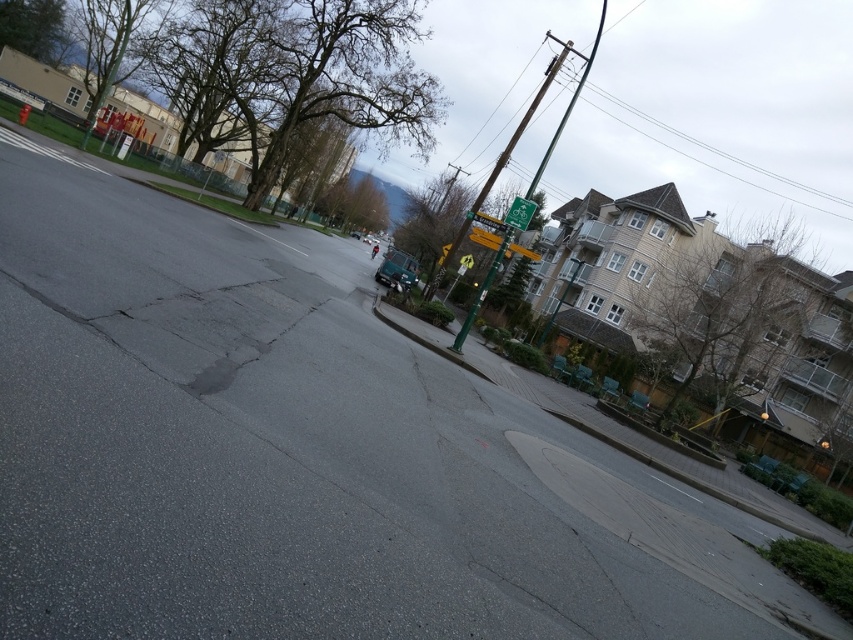
Question: Is green plastic sign at upper center to the right of green plastic traffic sign at center from the viewer's perspective?

Choices:
 (A) no
 (B) yes

Answer: (B)

Question: Does green plastic sign at upper center appear on the right side of metallic yellow traffic sign at upper right?

Choices:
 (A) yes
 (B) no

Answer: (A)

Question: Which point is farther from the camera taking this photo?

Choices:
 (A) (x=514, y=205)
 (B) (x=469, y=230)
 (C) (x=531, y=250)
 (D) (x=486, y=275)

Answer: (C)

Question: Which point is farther from the camera taking this photo?

Choices:
 (A) (495, 253)
 (B) (508, 246)
 (C) (413, 266)
 (D) (496, 220)

Answer: (C)

Question: Which point is farther to the camera?

Choices:
 (A) green painted wood utility pole at upper right
 (B) green plastic bicycle sign at center
 (C) metallic yellow traffic sign at upper right
 (D) green plastic sign at upper center

Answer: (A)

Question: Is green plastic sign at upper center in front of green plastic traffic sign at center?

Choices:
 (A) no
 (B) yes

Answer: (B)